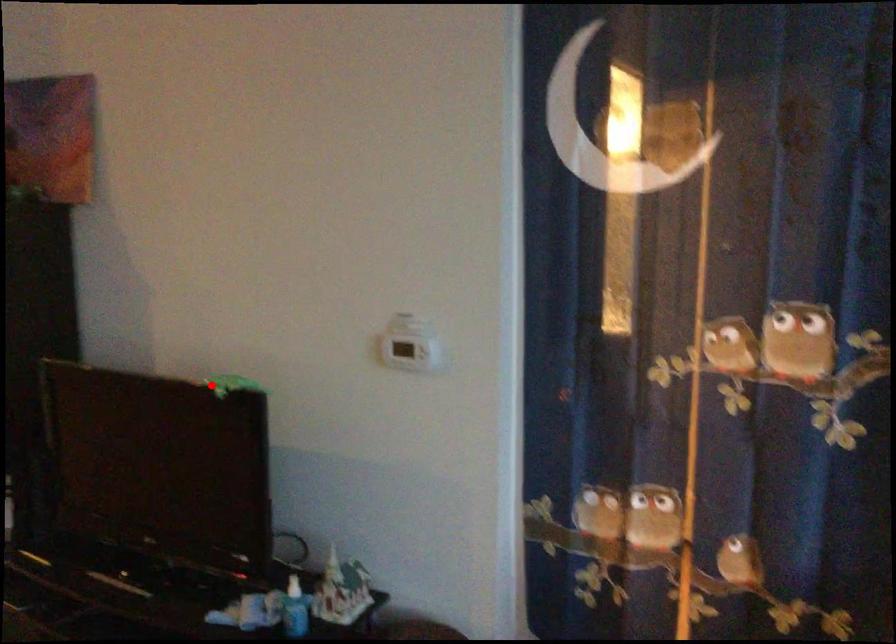
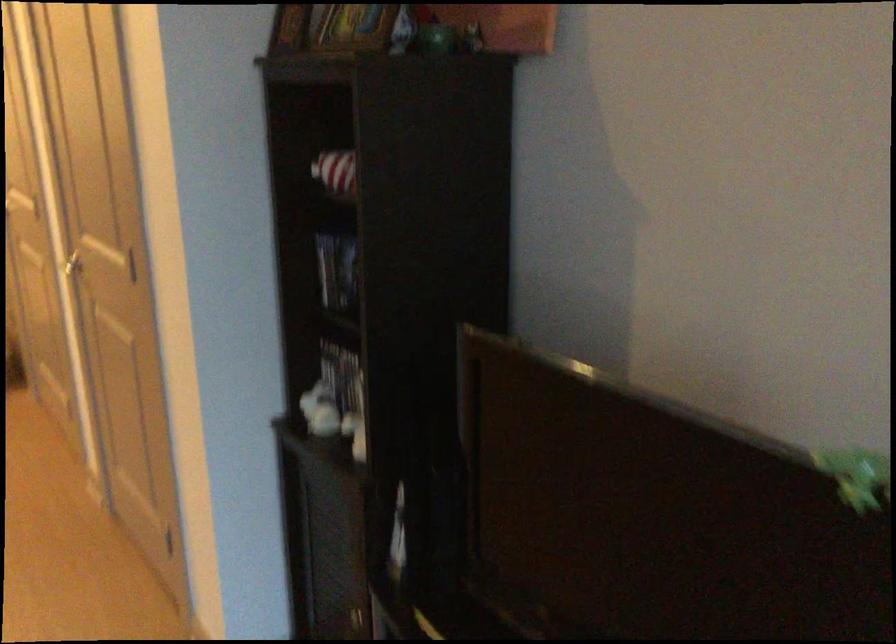
Question: I am providing you with two images of the same scene from different viewpoints. A red point is shown in image1. For the corresponding object point in image2, is it positioned nearer or farther from the camera?

Choices:
 (A) Nearer
 (B) Farther

Answer: (A)